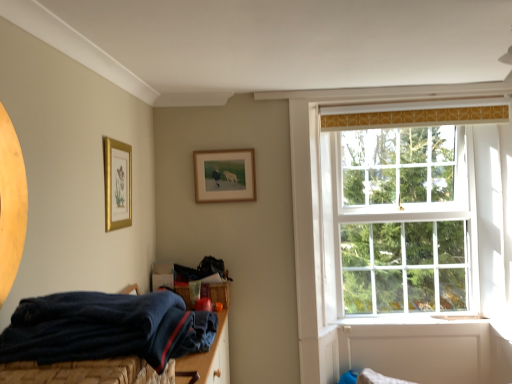
Question: Considering the positions of navy blue fabric bed at lower left and gold framed picture at upper left, which ranks as the 2th picture frame in back-to-front order, in the image, is navy blue fabric bed at lower left bigger or smaller than gold framed picture at upper left, which ranks as the 2th picture frame in back-to-front order,?

Choices:
 (A) big
 (B) small

Answer: (A)

Question: Would you say navy blue fabric bed at lower left is to the left or to the right of gold framed picture at upper left, the 1th picture frame in the front-to-back sequence, in the picture?

Choices:
 (A) left
 (B) right

Answer: (B)

Question: Estimate the real-world distances between objects in this image. Which object is farther from the white wooden window at upper right?

Choices:
 (A) navy blue fabric bed at lower left
 (B) gold framed picture at upper left, placed as the first picture frame when sorted from left to right
 (C) wooden frame at upper center, which is the 1th picture frame from back to front

Answer: (B)

Question: Which object is the farthest from the gold framed picture at upper left, the second picture frame viewed from the right?

Choices:
 (A) navy blue fabric bed at lower left
 (B) white wooden window at upper right
 (C) wooden frame at upper center, placed as the 2th picture frame when sorted from front to back

Answer: (B)